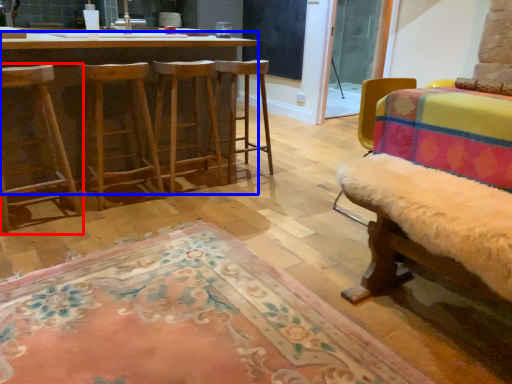
Question: Which point is further to the camera, chair (highlighted by a red box) or desk (highlighted by a blue box)?

Choices:
 (A) chair
 (B) desk

Answer: (B)